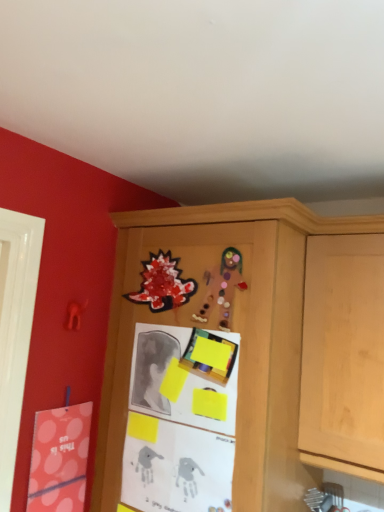
Question: Is glittery paper dinosaur at upper center, which ranks as the 2th art in right-to-left order, taller or shorter than matte pink postcard at left?

Choices:
 (A) tall
 (B) short

Answer: (B)

Question: In the image, is glittery paper dinosaur at upper center, which ranks as the second art in front-to-back order, on the left side or the right side of matte pink postcard at left?

Choices:
 (A) left
 (B) right

Answer: (B)

Question: Which of these objects is positioned farthest from the wooden cabinet at center?

Choices:
 (A) matte cardboard gingerbread man at upper center, the 2th art viewed from the back
 (B) matte pink postcard at left
 (C) yellow paper at center
 (D) glittery paper dinosaur at upper center, acting as the 1th art starting from the back

Answer: (B)

Question: Which is nearer to the matte pink postcard at left?

Choices:
 (A) glittery paper dinosaur at upper center, which ranks as the 2th art in right-to-left order
 (B) matte cardboard gingerbread man at upper center, which appears as the second art when viewed from the left
 (C) yellow paper at center
 (D) wooden cabinet at center

Answer: (C)